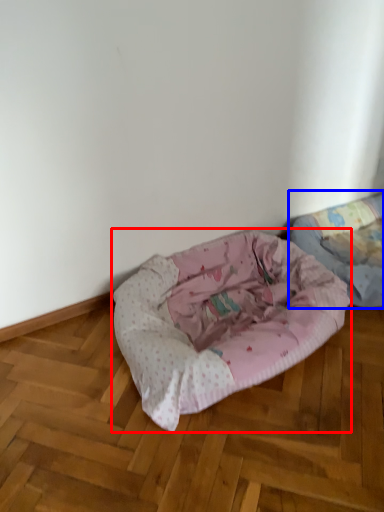
Question: Which of the following is the farthest to the observer, dog bed (highlighted by a red box) or dog bed (highlighted by a blue box)?

Choices:
 (A) dog bed
 (B) dog bed

Answer: (B)